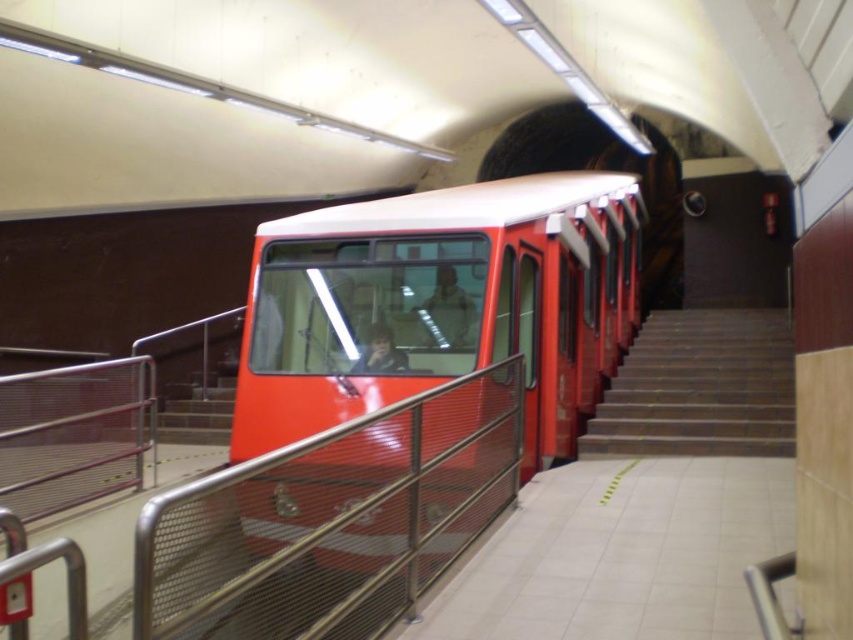
Does metal mesh railing at center appear on the right side of smooth concrete stairs at right?

In fact, metal mesh railing at center is to the left of smooth concrete stairs at right.

This screenshot has width=853, height=640. Identify the location of metal mesh railing at center. (331, 520).

Where is `metal mesh railing at center`? Image resolution: width=853 pixels, height=640 pixels. metal mesh railing at center is located at coordinates (331, 520).

Can you confirm if matte red train at center is shorter than metal mesh railing at center?

Yes, matte red train at center is shorter than metal mesh railing at center.

Is matte red train at center bigger than metal mesh railing at center?

Actually, matte red train at center might be smaller than metal mesh railing at center.

Where is `matte red train at center`? matte red train at center is located at coordinates (440, 305).

Is matte red train at center thinner than smooth concrete stairs at right?

Correct, matte red train at center's width is less than smooth concrete stairs at right's.

Is point (270, 250) more distant than point (672, 381)?

No, (270, 250) is closer to viewer.

Is point (351, 236) farther from camera compared to point (643, 365)?

No.

I want to click on matte red train at center, so click(440, 305).